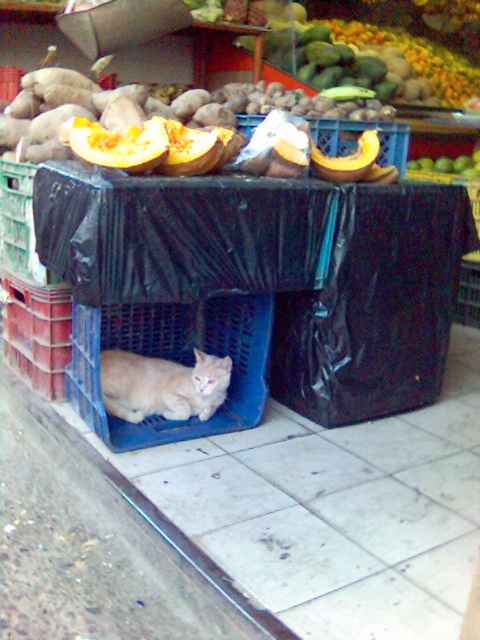
You are a customer at the market stall and want to buy both the orange fleshed squash at center and the orange smooth pumpkin at center. Which one is taller?

The orange fleshed squash at center is taller than the orange smooth pumpkin at center.

There are two objects in the image, the orange smooth pumpkin at center and the light brown cat in blue plastic crate. How far apart are they?

The orange smooth pumpkin at center and the light brown cat in blue plastic crate are 2.34 meters apart.

You are a customer at the market stall. You see a light orange fur cat at center and an orange smooth pumpkin at center. Which object is closer to you?

The light orange fur cat at center is closer to you because it is further to the viewer than the orange smooth pumpkin at center.